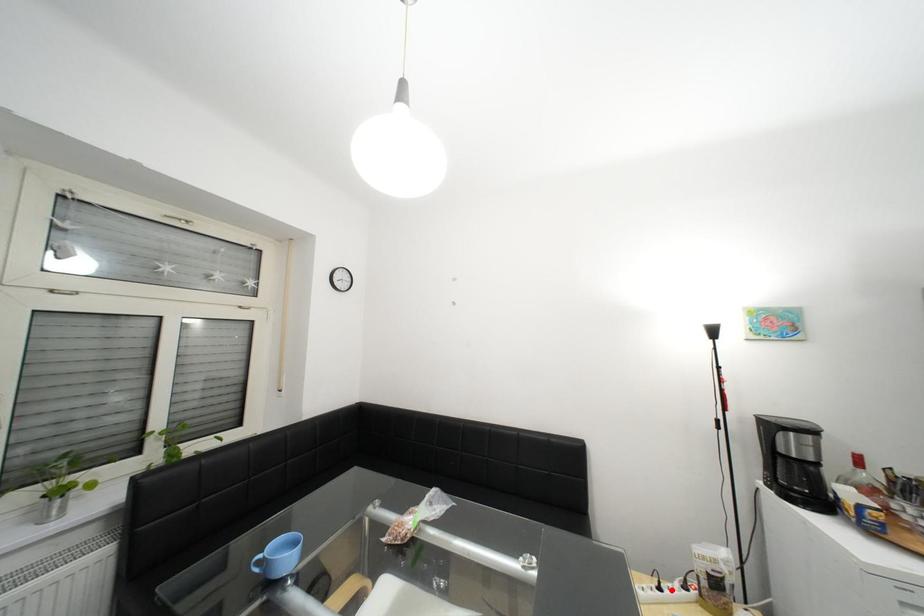
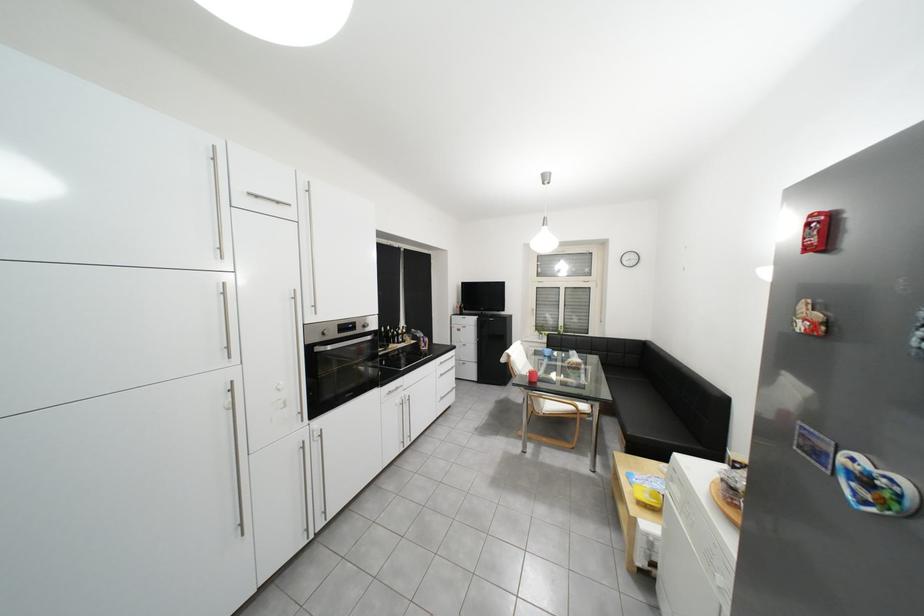
Question: I am providing you with two images of the same scene from different viewpoints. A red point is marked on the first image. At the location where the point appears in image 1, is it still visible in image 2?

Choices:
 (A) Yes
 (B) No

Answer: (B)